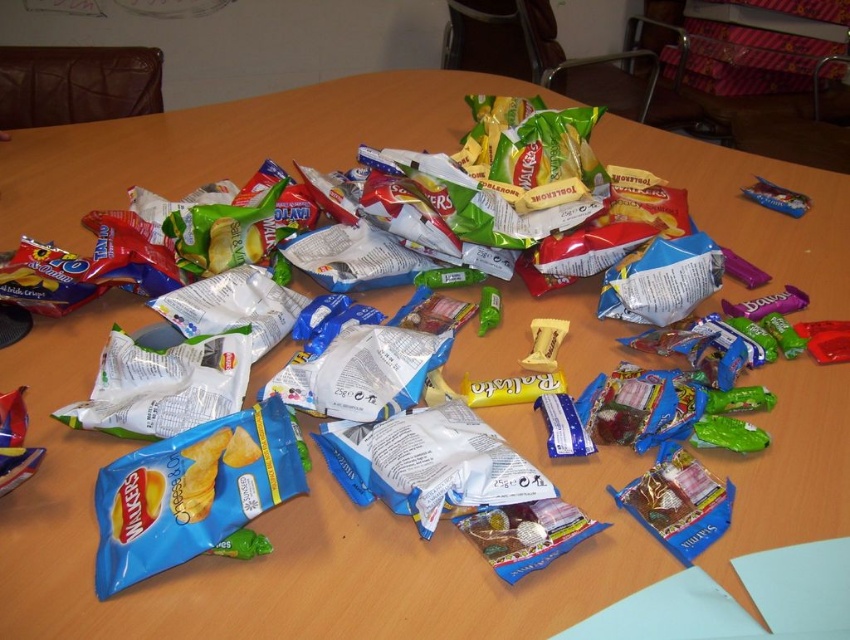
Question: Which point is closer to the camera?

Choices:
 (A) (488, 305)
 (B) (128, 468)

Answer: (B)

Question: Can you confirm if blue matte chip bag at lower left is wider than green rubber toy at center?

Choices:
 (A) yes
 (B) no

Answer: (A)

Question: Is blue matte chip bag at lower left smaller than green rubber toy at center?

Choices:
 (A) no
 (B) yes

Answer: (A)

Question: Which point is farther from the camera taking this photo?

Choices:
 (A) (170, 540)
 (B) (483, 332)

Answer: (B)

Question: Does blue matte chip bag at lower left have a larger size compared to green rubber toy at center?

Choices:
 (A) no
 (B) yes

Answer: (B)